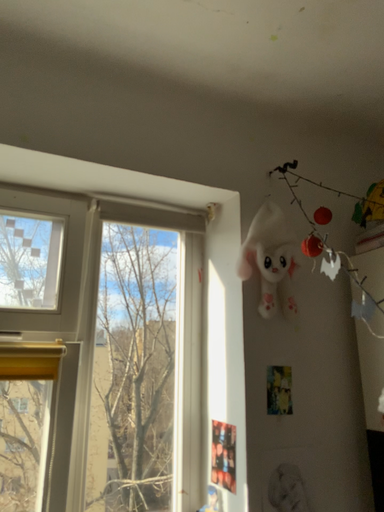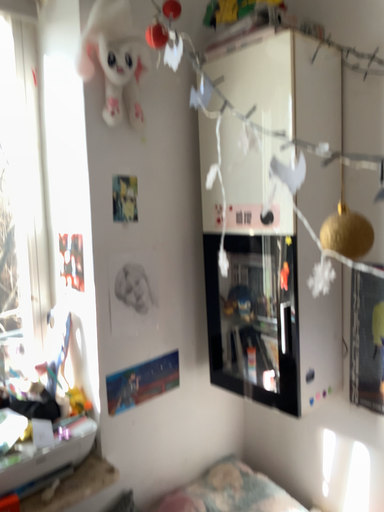
Question: How did the camera likely rotate when shooting the video?

Choices:
 (A) rotated left
 (B) rotated right

Answer: (B)